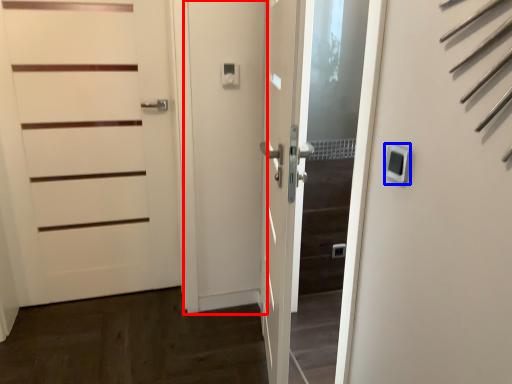
Question: Which object is closer to the camera taking this photo, screen door (highlighted by a red box) or thermostat (highlighted by a blue box)?

Choices:
 (A) screen door
 (B) thermostat

Answer: (B)